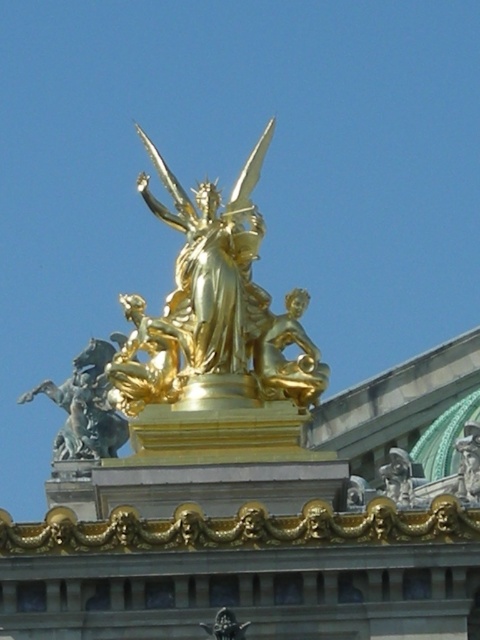
Based on the photo, you are an architect designing a new building and want to place a decorative item between the shiny blue horse at left and the gold metallic sword at center. Which object should you place the item closer to if you want it to be closer to the taller object?

The shiny blue horse at left is taller than the gold metallic sword at center, so placing the decorative item closer to the shiny blue horse at left would position it nearer to the taller object.

You are an architect designing a new building and want to place a golden statue similar to the one in the image. If you want to place a shiny blue horse at left at coordinates similar to the one in the image, where should you place it?

The shiny blue horse at left should be placed at coordinates approximately 0.637 on the x axis and 0.177 on the y axis, as per the original statue.